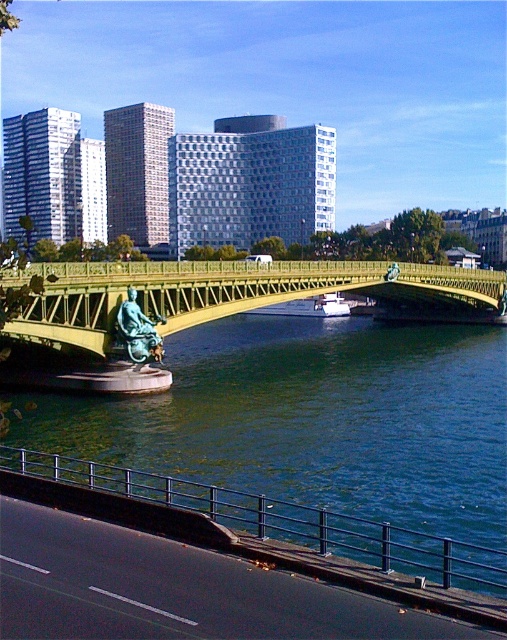
Does point (465, 353) come in front of point (151, 346)?

That is False.

Does greenish-blue water at center appear over bronze statue at center?

Actually, greenish-blue water at center is below bronze statue at center.

Is point (185, 481) positioned after point (126, 339)?

No, it is not.

The height and width of the screenshot is (640, 507). I want to click on greenish-blue water at center, so click(x=312, y=440).

Between greenish-blue water at center and metallic gold bridge at center, which one appears on the left side from the viewer's perspective?

Positioned to the left is greenish-blue water at center.

Is greenish-blue water at center below metallic gold bridge at center?

Yes, greenish-blue water at center is below metallic gold bridge at center.

Is point (359, 484) positioned in front of point (62, 272)?

Yes, it is.

What are the coordinates of `greenish-blue water at center` in the screenshot? It's located at pyautogui.click(x=312, y=440).

Between bronze statue at center and white glossy boat at center, which one appears on the right side from the viewer's perspective?

white glossy boat at center is more to the right.

Consider the image. Does bronze statue at center have a smaller size compared to white glossy boat at center?

Yes.

Describe the element at coordinates (137, 332) in the screenshot. The width and height of the screenshot is (507, 640). I see `bronze statue at center` at that location.

Find the location of `bronze statue at center`. bronze statue at center is located at coordinates (137, 332).